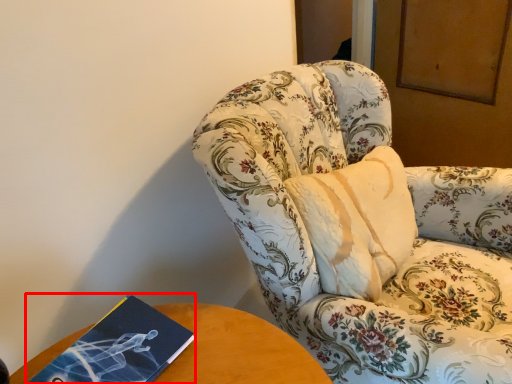
Question: From the image's perspective, what is the correct spatial positioning of paperback book (annotated by the red box) in reference to chair?

Choices:
 (A) below
 (B) above

Answer: (A)